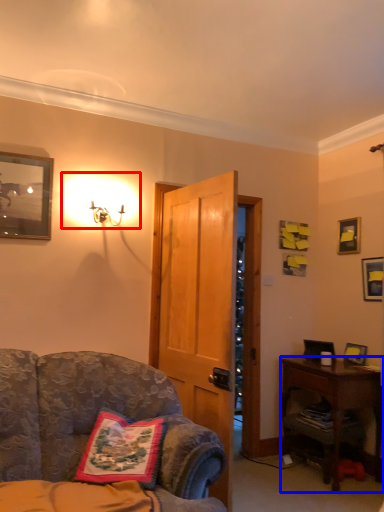
Question: Which of the following is the closest to the observer, lighting (highlighted by a red box) or desk (highlighted by a blue box)?

Choices:
 (A) lighting
 (B) desk

Answer: (A)